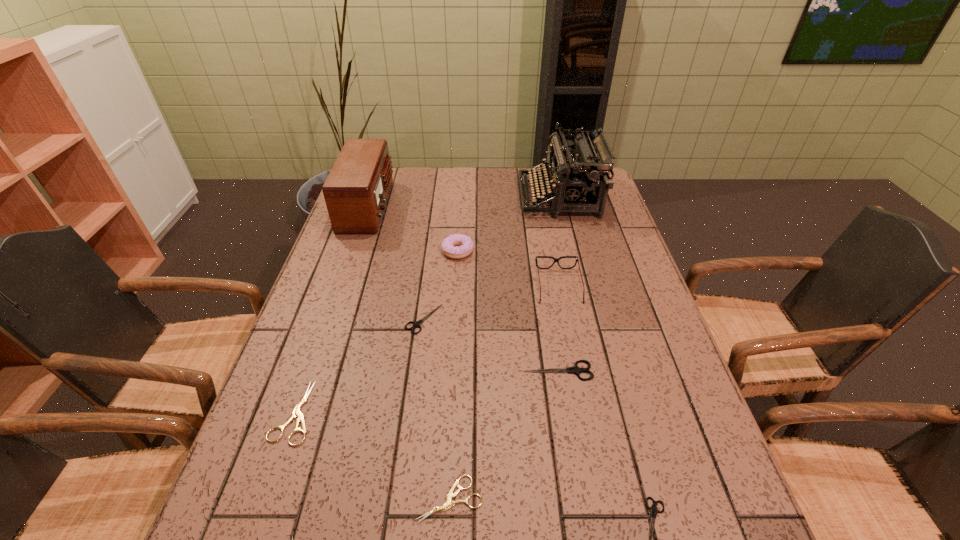
Where is `free spot that satisfies the following two spatial constraints: 1. on the front-facing side of the second tallest object; 2. on the back side of the second biggest black shears`? The height and width of the screenshot is (540, 960). free spot that satisfies the following two spatial constraints: 1. on the front-facing side of the second tallest object; 2. on the back side of the second biggest black shears is located at coordinates (330, 319).

Where is `vacant space that satisfies the following two spatial constraints: 1. on the typing side of the tallest object; 2. with the lenses facing outward on the spectacles`? vacant space that satisfies the following two spatial constraints: 1. on the typing side of the tallest object; 2. with the lenses facing outward on the spectacles is located at coordinates (581, 286).